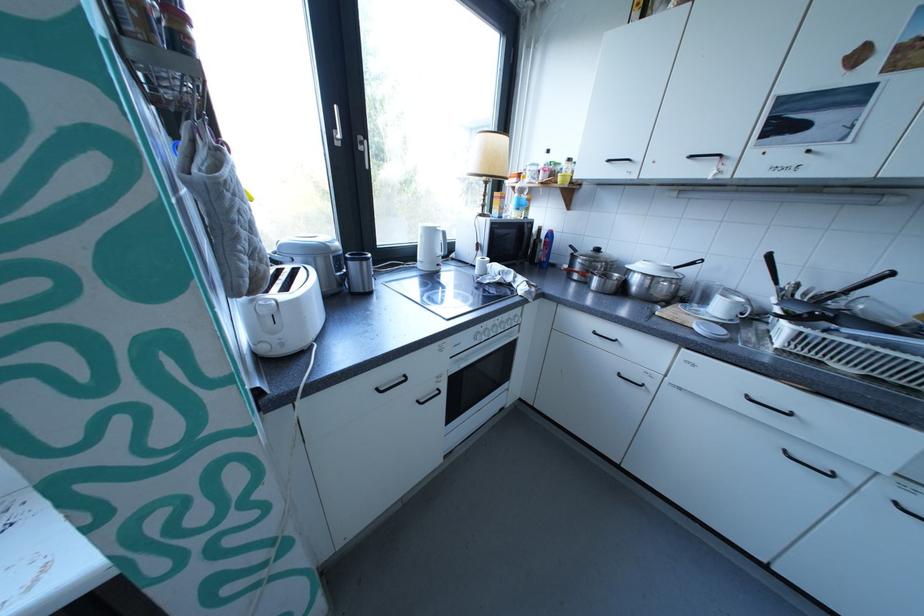
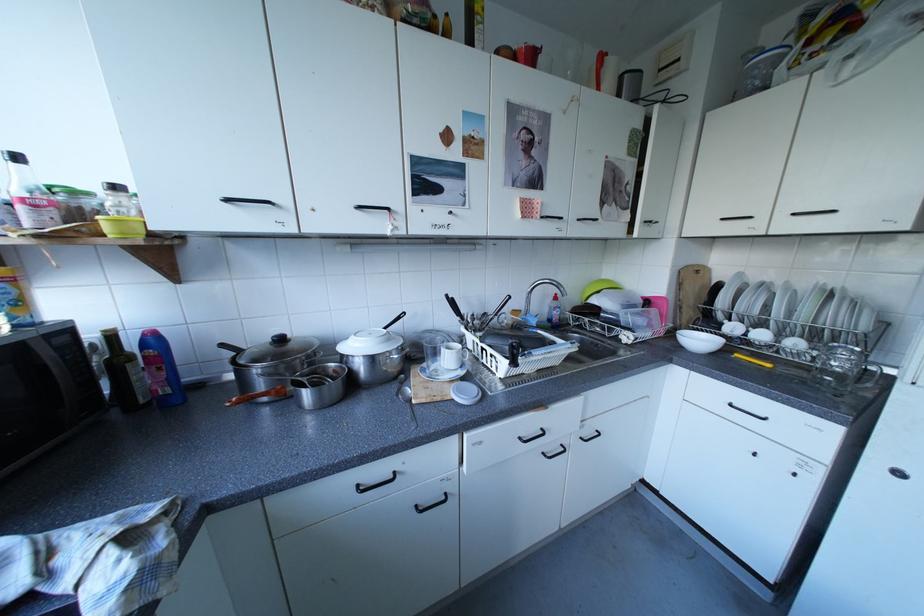
Question: The camera is either moving clockwise (left) or counter-clockwise (right) around the object. The first image is from the beginning of the video and the second image is from the end. Is the camera moving left or right when shooting the video?

Choices:
 (A) Left
 (B) Right

Answer: (A)